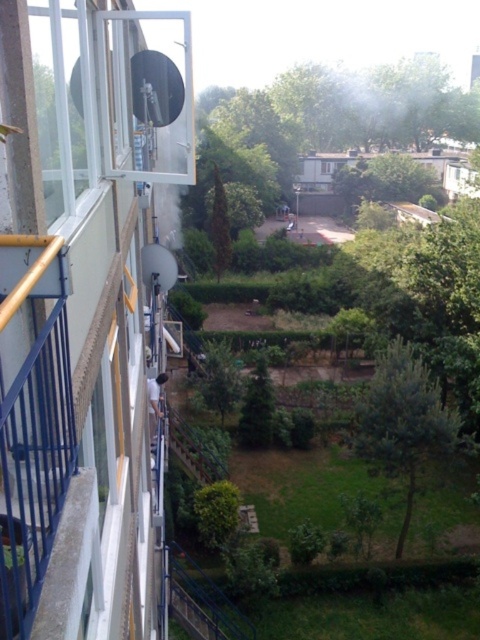
You are standing on the balcony and want to determine the relative positions of two points marked in the scene. Which of the two points, point 1 at coordinates point (408, 442) or point 2 at coordinates point (264, 413), is closer to you?

Point 1 at coordinates point (408, 442) is closer to the viewer than point 2 at coordinates point (264, 413).